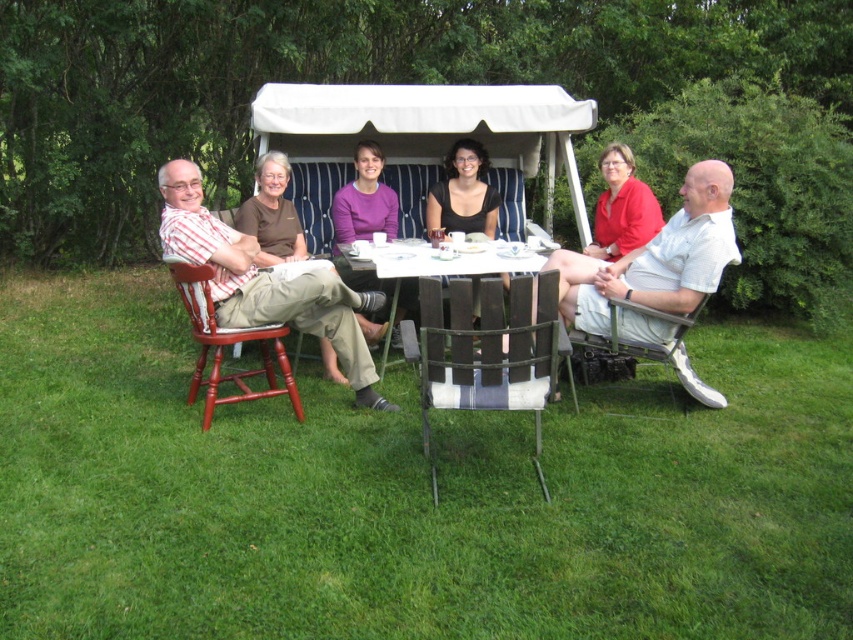
Is white wood table at center bigger than black matte shirt at center?

Yes.

Is white wood table at center thinner than black matte shirt at center?

Incorrect, white wood table at center's width is not less than black matte shirt at center's.

At what (x,y) coordinates should I click in order to perform the action: click on white wood table at center. Please return your answer as a coordinate pair (x, y). Looking at the image, I should click on (442, 262).

Consider the image. Can you confirm if brown woven chair at center is taller than mahogany wood chair at left?

Yes.

Locate an element on the screen. This screenshot has width=853, height=640. brown woven chair at center is located at coordinates (485, 353).

The image size is (853, 640). I want to click on brown woven chair at center, so click(x=485, y=353).

Can you confirm if red matte shirt at center is thinner than white wood table at center?

Yes, red matte shirt at center is thinner than white wood table at center.

At what (x,y) coordinates should I click in order to perform the action: click on red matte shirt at center. Please return your answer as a coordinate pair (x, y). The width and height of the screenshot is (853, 640). Looking at the image, I should click on (621, 208).